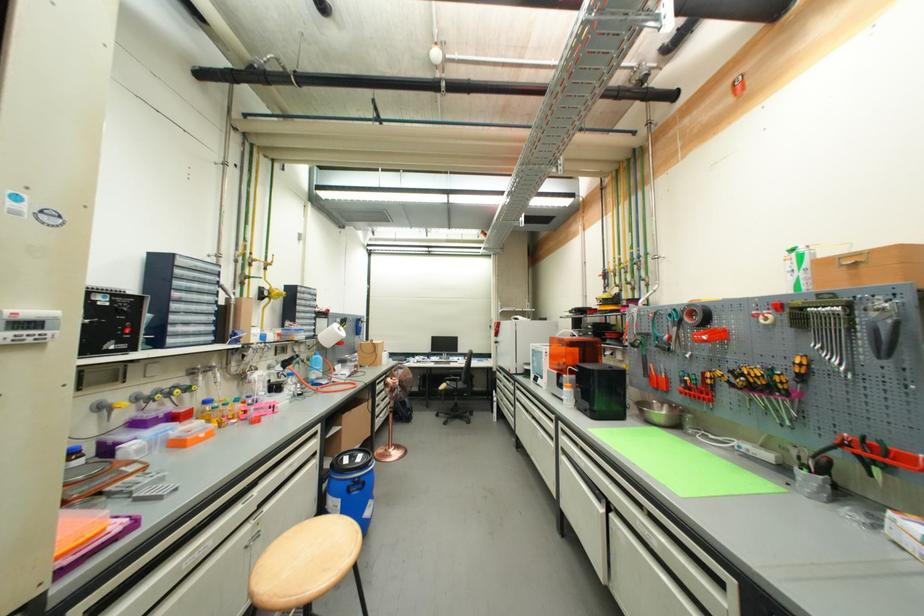
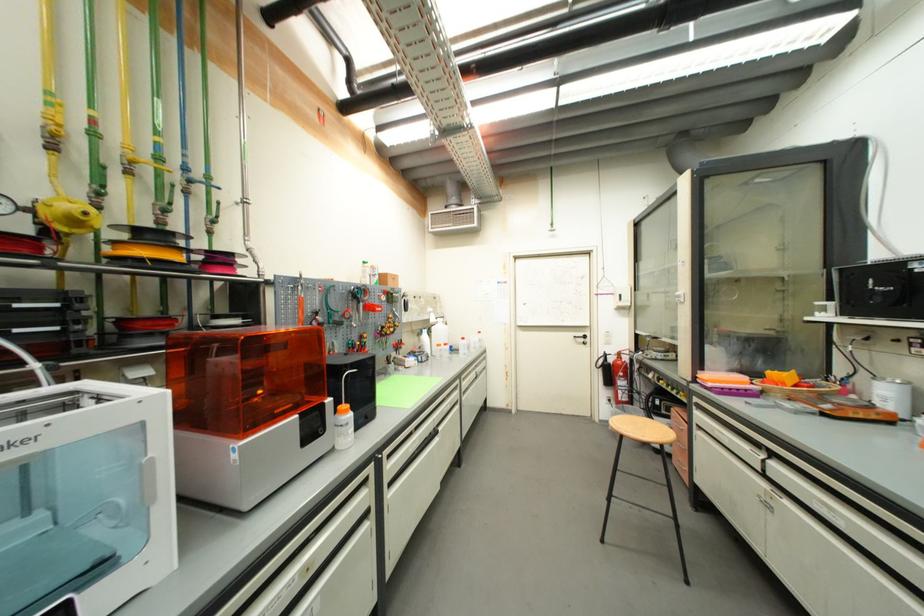
Where in the second image is the point corresponding to (x=258, y=498) from the first image?

(764, 456)